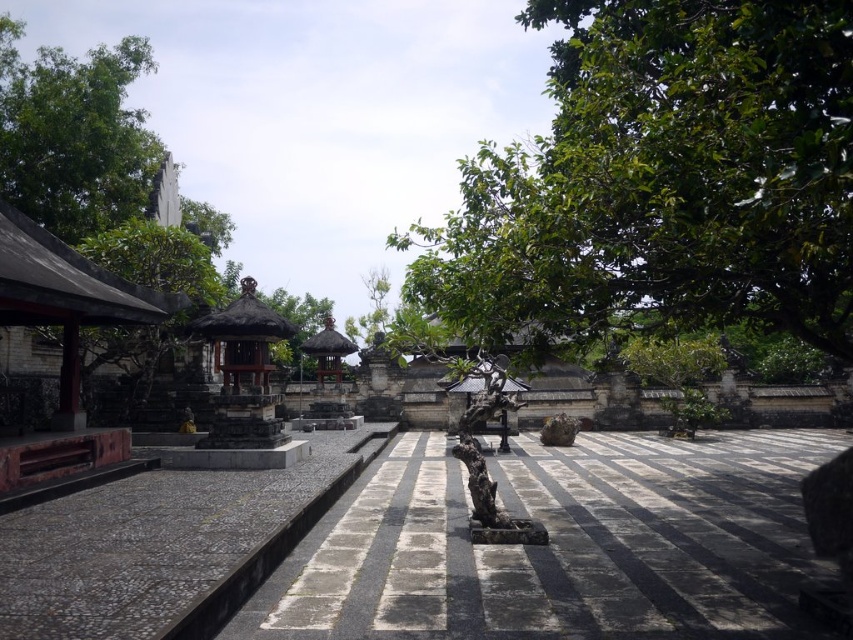
Question: Considering the relative positions of green leafy tree at upper right and thatched wood gazebo at center in the image provided, where is green leafy tree at upper right located with respect to thatched wood gazebo at center?

Choices:
 (A) below
 (B) above

Answer: (B)

Question: Can you confirm if green leafy tree at upper right is smaller than green leafy tree at upper left?

Choices:
 (A) yes
 (B) no

Answer: (B)

Question: In this image, where is green leafy tree at upper right located relative to dark brown stone tree trunk at center?

Choices:
 (A) left
 (B) right

Answer: (B)

Question: Which object appears closest to the camera in this image?

Choices:
 (A) thatched roof gazebo at center
 (B) gray stone path at center
 (C) thatched wood gazebo at center
 (D) dark brown stone tree trunk at center

Answer: (B)

Question: Estimate the real-world distances between objects in this image. Which object is closer to the thatched roof gazebo at center?

Choices:
 (A) dark brown stone tree trunk at center
 (B) green leafy tree at upper right

Answer: (A)

Question: Which object is the closest to the thatched roof gazebo at center?

Choices:
 (A) gray stone path at center
 (B) green leafy tree at upper right
 (C) dark brown stone tree trunk at center

Answer: (C)